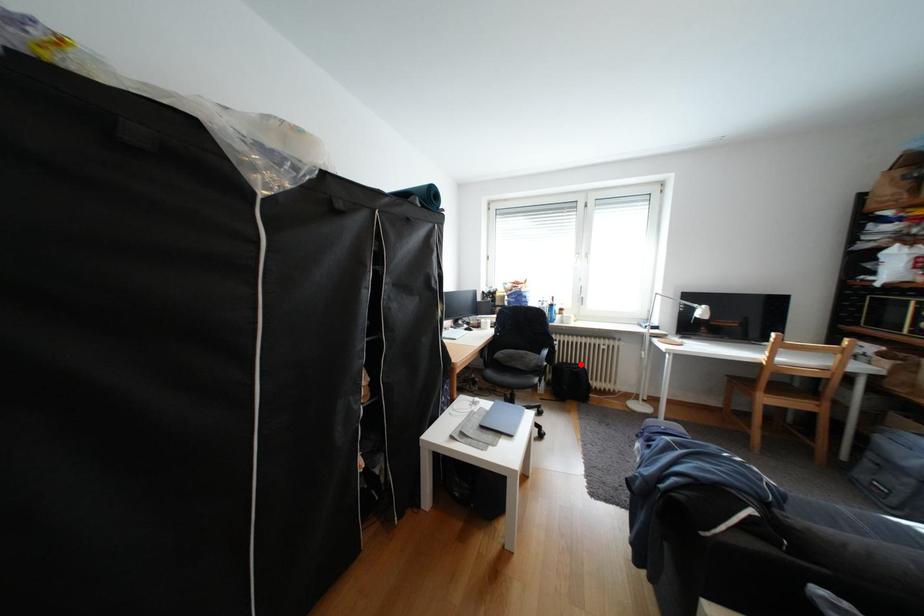
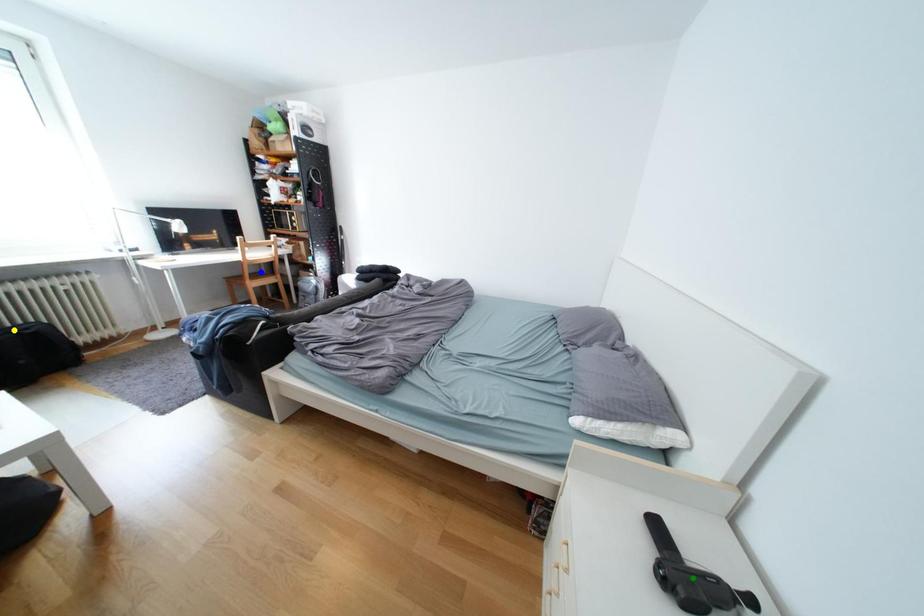
Question: I am providing you with two images of the same scene from different viewpoints. A red point is marked on the first image. You are given multiple points on the second image. Which spot in image 2 lines up with the point in image 1?

Choices:
 (A) yellow point
 (B) green point
 (C) blue point

Answer: (A)